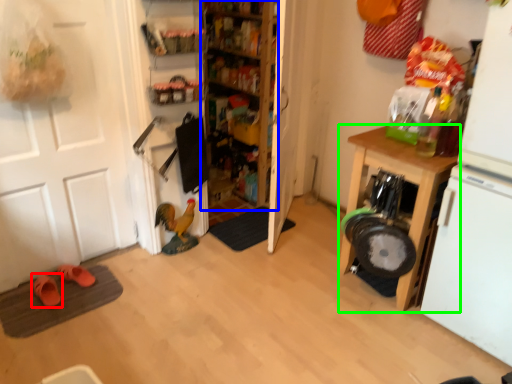
Question: Considering the real-world distances, which object is farthest from footwear (highlighted by a red box)? shelf (highlighted by a blue box) or cabinetry (highlighted by a green box)?

Choices:
 (A) shelf
 (B) cabinetry

Answer: (B)